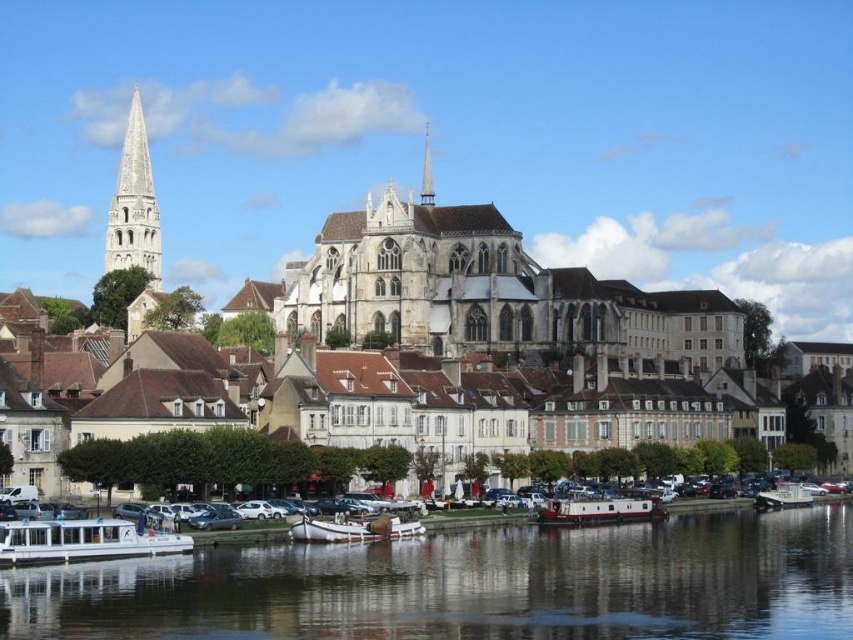
You are an architect visiting this riverside area and want to take a photo of both the white stone spire at upper left and the smooth white spire at center. From your current position, which spire should you aim your camera towards first to capture both in the frame?

You should aim your camera towards the white stone spire at upper left first since it is to the left of the smooth white spire at center, allowing both to be captured in the frame when positioned correctly.

In the scene shown: You are standing on the riverside path and want to take a photo of both the smooth dark water at lower center and the white wooden boat at lower center. Based on their positions, which one should you focus on first to ensure both are in clear view?

Since the smooth dark water at lower center is in front of the white wooden boat at lower center, you should focus on the white wooden boat at lower center first to ensure both are in clear view.

You are an architect analyzing the spatial arrangement of the cathedral complex. Which spire, the white stone spire at upper left or the smooth white spire at center, is located closer to the foreground of the image?

The white stone spire at upper left is positioned under the smooth white spire at center, meaning it is closer to the foreground of the image.